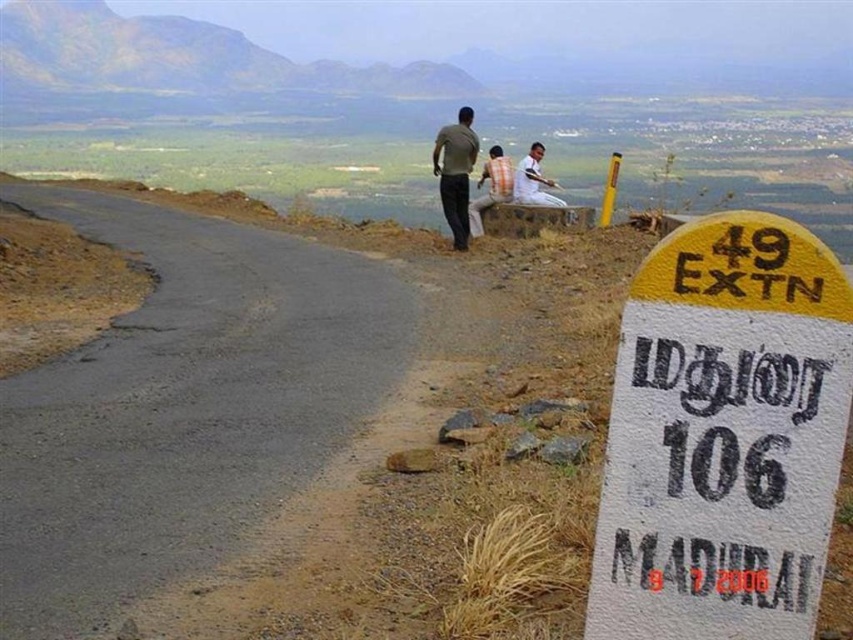
You are driving a car that is 2.5 meters wide. You need to pass between the black asphalt road at left and the white painted stone sign at right. Can your car fit through the space between them?

The distance between the black asphalt road at left and the white painted stone sign at right is 3.30 meters. Since your car is 2.5 meters wide, it can fit through the space as the distance is wider than the car.

You are a hiker who wants to follow the black asphalt road at left to reach the light brown wooden stick at upper center. Which direction should you walk relative to the road?

You should walk to the right along the black asphalt road at left because the light brown wooden stick at upper center is located to the right of the road.